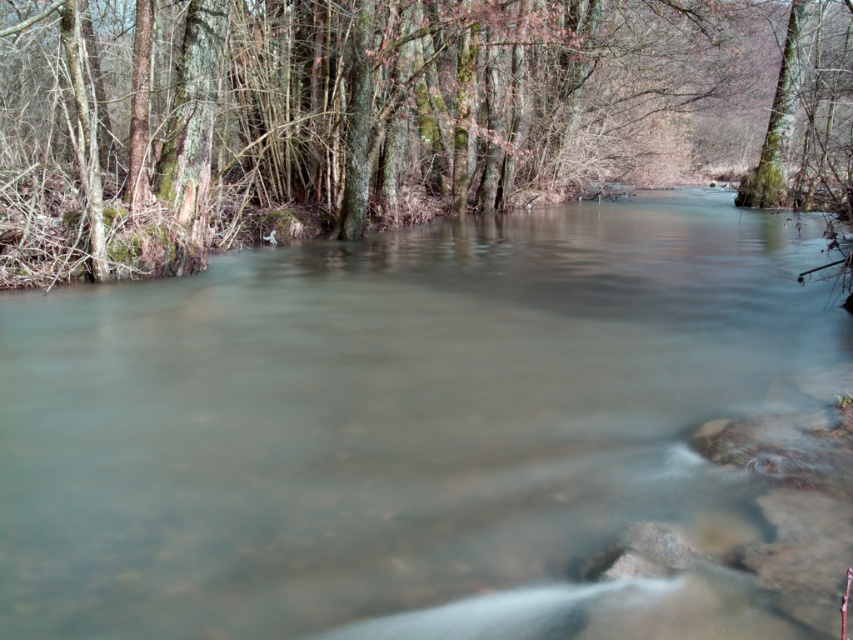
You are standing at the origin point of the image. Which direction should you move to reach the clear water at center?

The clear water at center is located at coordinates point 0.667 on the x axis and 0.476 on the y axis, so you should move towards the right and slightly upward from the origin point to reach it.

You are a hiker standing at the edge of the river. You see the clear water at center and the green mossy tree at upper left. Which object is taller?

The green mossy tree at upper left is taller than the clear water at center.

You are standing at the edge of the river and want to cross to the other side. The green mossy tree at upper left is directly above your current position. Where should you look to find the clear water at center that might help you cross?

The clear water at center is positioned under the green mossy tree at upper left, so look directly below the tree to find the clear water that can help you cross.